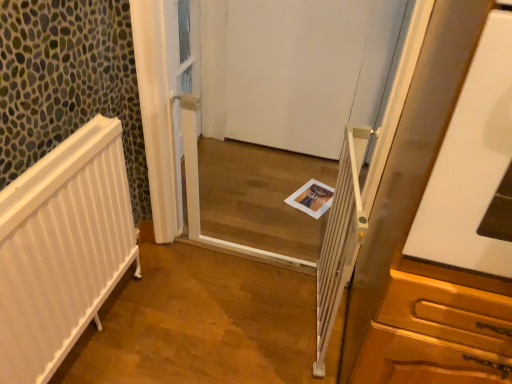
Find the location of a particular element. This screenshot has height=384, width=512. empty space that is ontop of white paper magazine at center is located at coordinates (310, 193).